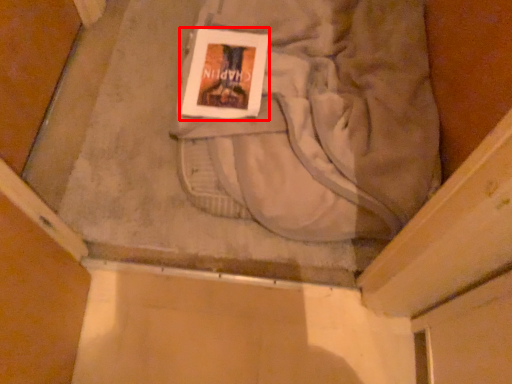
Question: Observing the image, what is the correct spatial positioning of paperback book (annotated by the red box) in reference to sweat pant?

Choices:
 (A) right
 (B) left

Answer: (B)